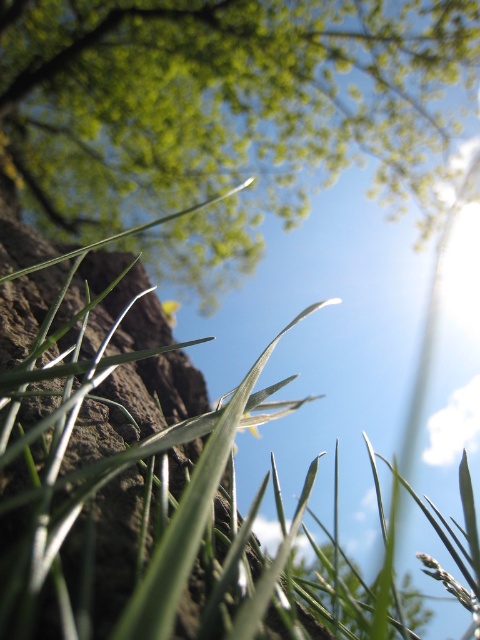
Based on the photo, can you confirm if green leafy grass at lower left is wider than green leafy tree at center?

No, green leafy grass at lower left is not wider than green leafy tree at center.

Which is in front, point (108, 296) or point (195, 285)?

Point (108, 296) is in front.

I want to click on green leafy grass at lower left, so click(x=154, y=481).